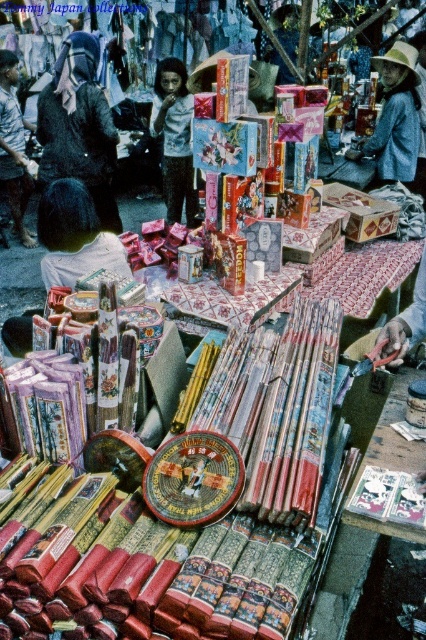
Based on the photo, you are a customer at the market and want to pick up an item from the table. You notice two points on the table marked as point 1 and point 2. Point 1 is at coordinates (55,177) and point 2 is at (11,54). If you were to reach for the item at point 1 first, would you have to extend your arm more compared to reaching for point 2?

Since point 1 is closer to the camera than point 2, reaching for point 1 would require less arm extension compared to point 2. Therefore, you would not have to extend your arm more for point 1 than point 2.